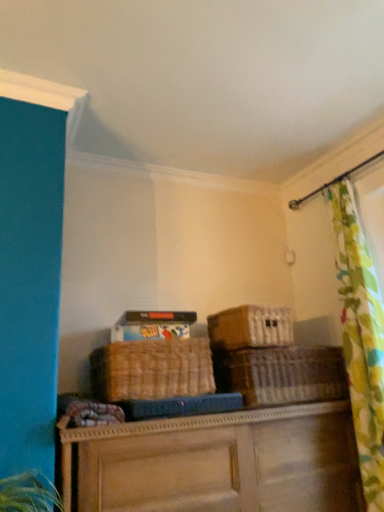
Question: Considering the positions of woven wicker basket at center and brown woven basket at center, arranged as the 2th basket when viewed from the right, in the image, is woven wicker basket at center taller or shorter than brown woven basket at center, arranged as the 2th basket when viewed from the right,?

Choices:
 (A) short
 (B) tall

Answer: (B)

Question: Looking at their shapes, would you say woven wicker basket at center is wider or thinner than brown woven basket at center, the 2th basket when ordered from left to right?

Choices:
 (A) wide
 (B) thin

Answer: (A)

Question: Based on their relative distances, which object is farther from the brown woven basket at center, the 2th basket when ordered from left to right?

Choices:
 (A) floral fabric curtain at right
 (B) woven brown basket at center, which appears as the 1th basket when viewed from the left
 (C) woven brown basket at center, which appears as the 1th basket when viewed from the right
 (D) woven wicker basket at center
 (E) matte cardboard storage box at upper center

Answer: (D)

Question: Which is farther from the brown woven basket at center, the 2th basket when ordered from left to right?

Choices:
 (A) matte cardboard storage box at upper center
 (B) woven wicker basket at center
 (C) woven brown basket at center, which appears as the 1th basket when viewed from the right
 (D) floral fabric curtain at right
 (E) woven brown basket at center, the third basket from the right

Answer: (B)